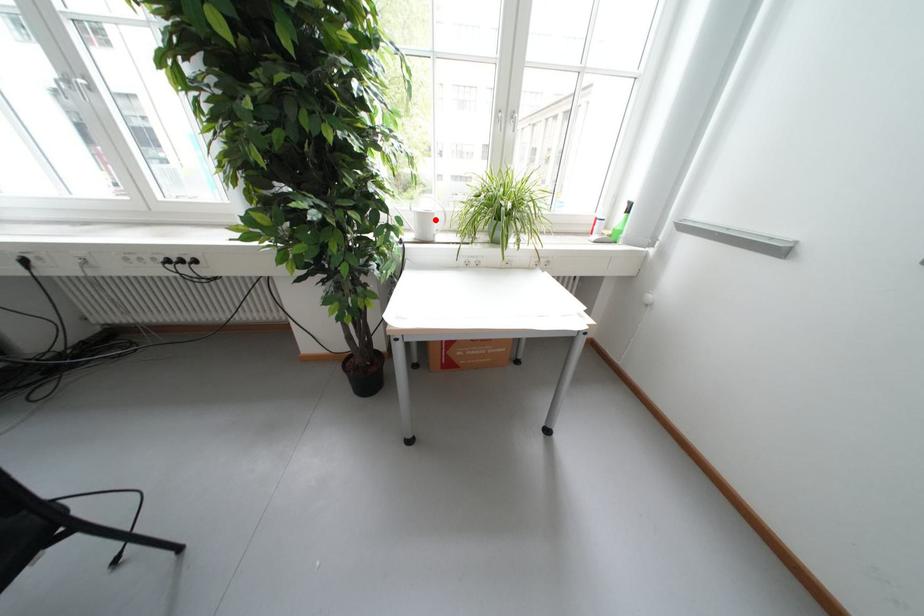
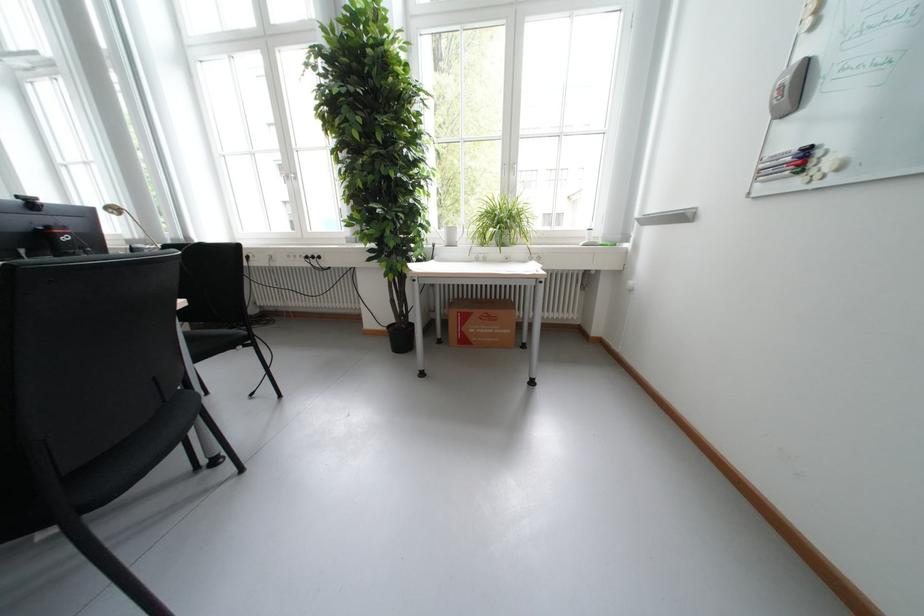
Where in the second image is the point corresponding to the highlighted location from the first image?

(460, 233)